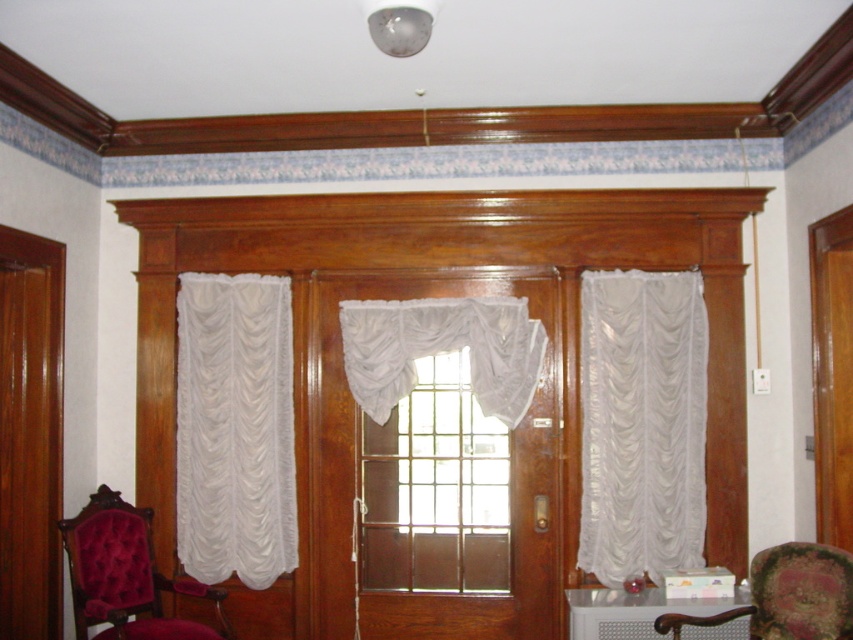
Question: Is white sheer curtain at left below velvet red rocking chair at lower left?

Choices:
 (A) no
 (B) yes

Answer: (A)

Question: Which of the following is the farthest from the observer?

Choices:
 (A) click(x=660, y=614)
 (B) click(x=419, y=451)

Answer: (B)

Question: Does white sheer curtain at center appear on the right side of velvet red rocking chair at lower left?

Choices:
 (A) no
 (B) yes

Answer: (B)

Question: Which object appears farthest from the camera in this image?

Choices:
 (A) white sheer curtain at right
 (B) clear glass window at center
 (C) white sheer curtain at center

Answer: (B)

Question: Is white sheer curtain at left positioned in front of velvet red rocking chair at lower left?

Choices:
 (A) yes
 (B) no

Answer: (B)

Question: Which point is closer to the camera?

Choices:
 (A) (654, 480)
 (B) (469, 317)
 (C) (259, 278)

Answer: (A)